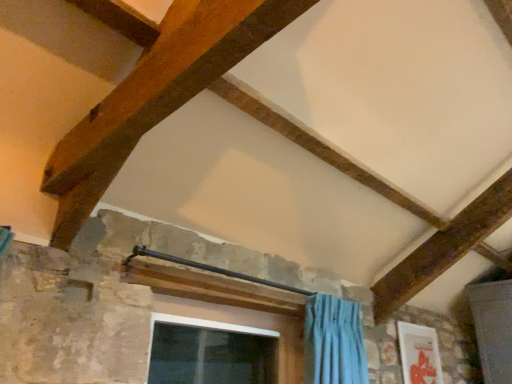
This screenshot has width=512, height=384. What do you see at coordinates (247, 326) in the screenshot?
I see `white plastic window at lower center` at bounding box center [247, 326].

Where is `white plastic window at lower center`? white plastic window at lower center is located at coordinates (247, 326).

Image resolution: width=512 pixels, height=384 pixels. I want to click on white plastic window at lower center, so click(x=247, y=326).